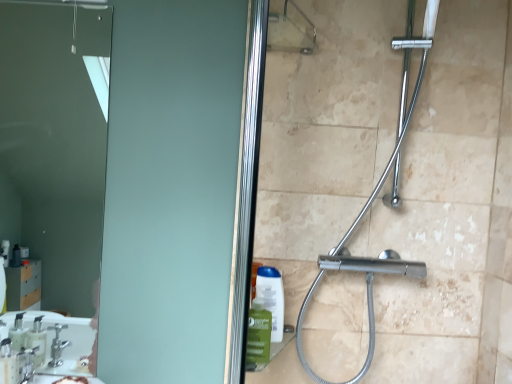
Question: Do you think translucent plastic soap dispenser at lower left is within chrome metallic shower at center, or outside of it?

Choices:
 (A) inside
 (B) outside

Answer: (B)

Question: Relative to chrome metallic shower at center, is translucent plastic soap dispenser at lower left in front or behind?

Choices:
 (A) front
 (B) behind

Answer: (B)

Question: Considering the real-world distances, which object is closest to the translucent plastic soap dispenser at lower left?

Choices:
 (A) matte glass mirror at upper left
 (B) chrome metallic shower at center

Answer: (B)

Question: Estimate the real-world distances between objects in this image. Which object is closer to the chrome metallic shower at center?

Choices:
 (A) translucent plastic soap dispenser at lower left
 (B) matte glass mirror at upper left

Answer: (A)